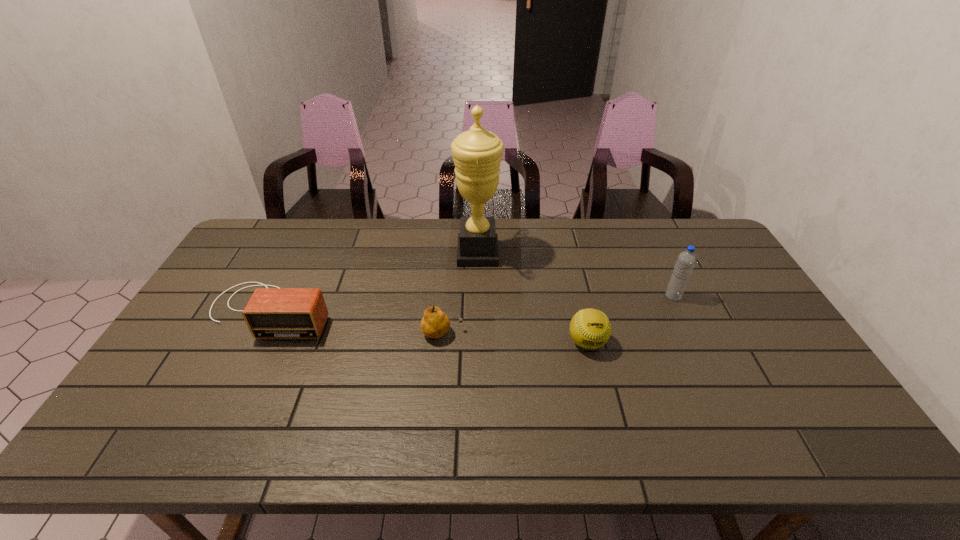
The width and height of the screenshot is (960, 540). Find the location of `vacant space located 0.270m on the logo side of the second object from right to left`. vacant space located 0.270m on the logo side of the second object from right to left is located at coordinates (613, 455).

The width and height of the screenshot is (960, 540). I want to click on vacant region located 0.300m on the back of the pear, so click(x=448, y=258).

Where is `object at the far edge`? The image size is (960, 540). object at the far edge is located at coordinates (477, 153).

Identify the location of object positioned at the left edge. Image resolution: width=960 pixels, height=540 pixels. (277, 313).

Find the location of a particular element. free location at the far edge of the desktop is located at coordinates (319, 234).

I want to click on vacant space at the near edge, so click(x=590, y=424).

In the image, there is a desktop. Where is `free region at the left edge`? free region at the left edge is located at coordinates (172, 393).

In the image, there is a desktop. Where is `vacant region at the right edge`? vacant region at the right edge is located at coordinates (766, 392).

In the image, there is a desktop. Identify the location of vacant space at the far left corner. tap(275, 232).

Where is `vacant space at the near left corner`? vacant space at the near left corner is located at coordinates (161, 450).